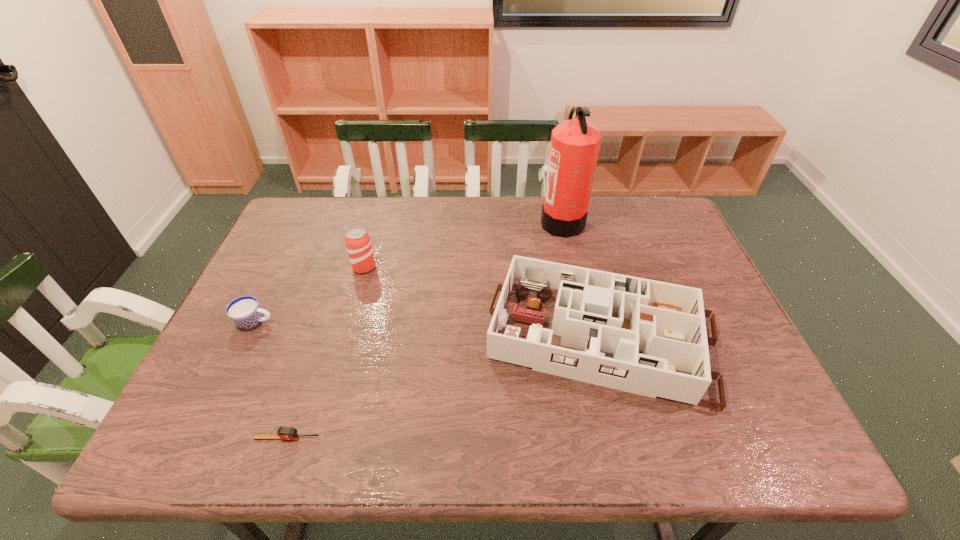
Where is `vacant space located 0.390m on the front side of the tallest object`? The image size is (960, 540). vacant space located 0.390m on the front side of the tallest object is located at coordinates (420, 221).

This screenshot has height=540, width=960. In order to click on vacant area located 0.180m on the front side of the tallest object in this screenshot , I will do `click(486, 221)`.

Where is `vacant space located 0.300m on the back of the fourth nearest object`? Image resolution: width=960 pixels, height=540 pixels. vacant space located 0.300m on the back of the fourth nearest object is located at coordinates (382, 201).

The width and height of the screenshot is (960, 540). I want to click on blank area located 0.090m on the front of the dollhouse, so click(x=632, y=456).

Image resolution: width=960 pixels, height=540 pixels. In order to click on blank area located 0.190m on the side of the leftmost object with the handle in this screenshot , I will do click(348, 322).

The width and height of the screenshot is (960, 540). In order to click on vacant area situated 0.360m on the back of the tape measure in this screenshot , I will do `click(331, 305)`.

Where is `object positioned at the far edge`? The height and width of the screenshot is (540, 960). object positioned at the far edge is located at coordinates (575, 143).

Locate an element on the screen. This screenshot has height=540, width=960. object at the near edge is located at coordinates (284, 433).

At what (x,y) coordinates should I click in order to perform the action: click on object present at the left edge. Please return your answer as a coordinate pair (x, y). Image resolution: width=960 pixels, height=540 pixels. Looking at the image, I should click on (245, 312).

Identify the location of object at the right edge. The width and height of the screenshot is (960, 540). (610, 316).